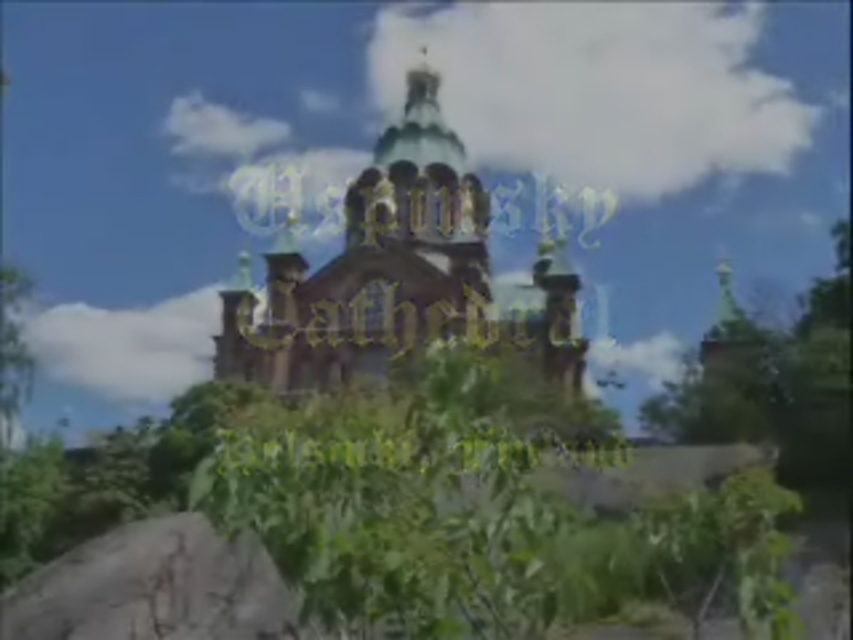
Question: Which object is closer to the camera taking this photo?

Choices:
 (A) gray rough stone at lower left
 (B) golden stone cathedral at center

Answer: (A)

Question: Can you confirm if golden stone cathedral at center is positioned to the right of gray rough stone at lower left?

Choices:
 (A) no
 (B) yes

Answer: (B)

Question: Is golden stone cathedral at center below gray rough stone at lower left?

Choices:
 (A) no
 (B) yes

Answer: (A)

Question: Which point appears farthest from the camera in this image?

Choices:
 (A) pos(389,300)
 (B) pos(163,552)

Answer: (A)

Question: Does golden stone cathedral at center come in front of gray rough stone at lower left?

Choices:
 (A) yes
 (B) no

Answer: (B)